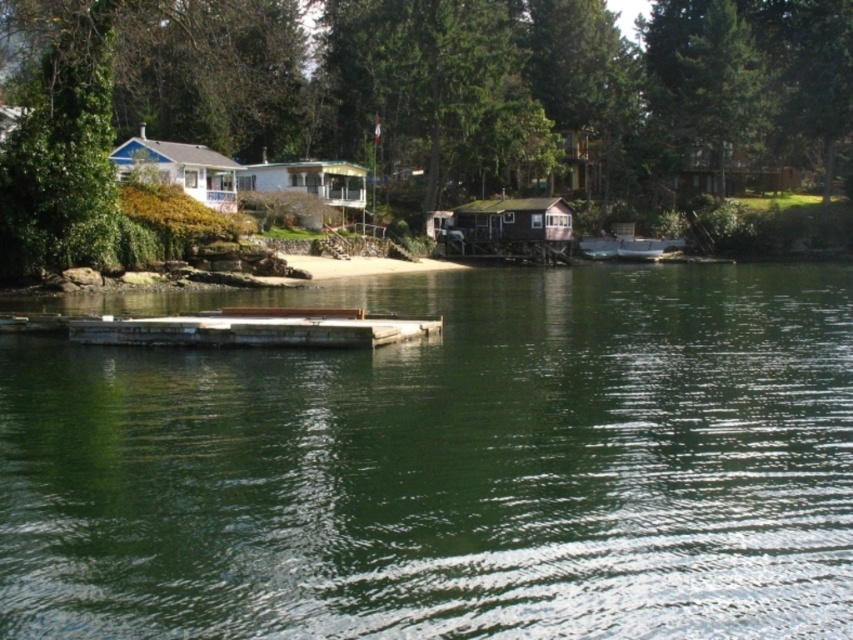
You are standing on the dock and see the green smooth water at center and the wooden boat at center. Which object is closer to your right side?

The wooden boat at center is closer to your right side because the green smooth water at center is to the left of it.

You are standing at point (718, 131) and want to walk to the dock. The dock is 92.47 meters away from your current position. If you can walk at a speed of 1.5 meters per second, how many seconds will it take you to reach the dock?

The distance between point (718, 131) and the dock is 92.47 meters. At a walking speed of 1.5 meters per second, it would take 92.47 divided by 1.5, which is approximately 61.65 seconds to reach the dock.

You are standing on the wooden dock and want to launch a small toy boat into the water. Which direction should you aim to ensure the toy boat floats on the green smooth water at center and not near the wooden boat at center?

You should aim towards the green smooth water at center since it is lower than the wooden boat at center, allowing the toy boat to float there without being obstructed by the wooden boat.